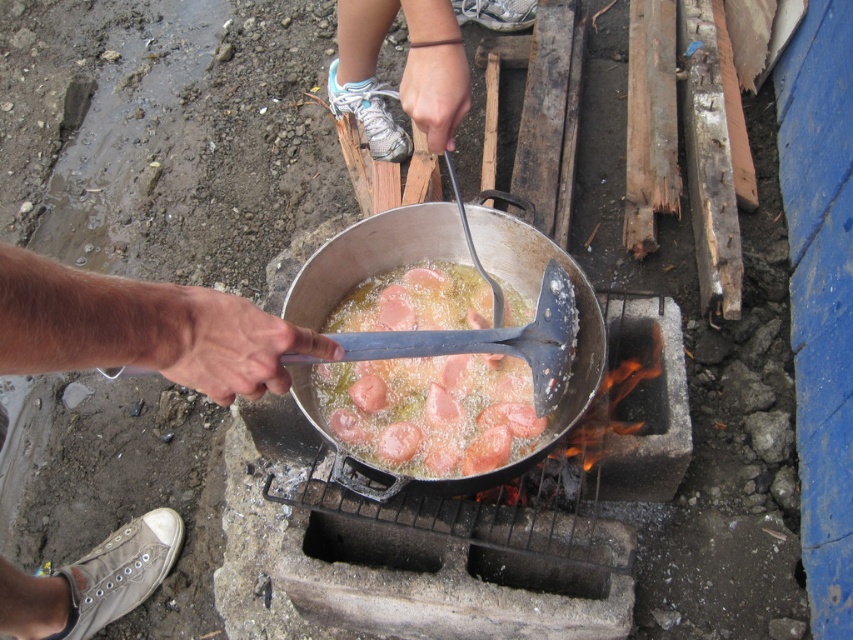
You are a food safety inspector observing this cooking scene. You notice two hands near the pot. The smooth skin hand at lower left is holding a clean utensil, while the white fabric hand at upper center is touching the pot directly with a glove. According to health regulations, which hand is violating the proper hygiene protocol?

The white fabric hand at upper center is violating proper hygiene protocol because it is touching the pot directly with a glove, which may contaminate the food, while the smooth skin hand at lower left is using a clean utensil appropriately.

You are a chef looking at the image of the outdoor cooking scene. You need to know the exact 2D coordinates of the pink glossy sausages at center to adjust the heat precisely. What are their coordinates?

The pink glossy sausages at center are located at the 2D coordinates of point [431,410].